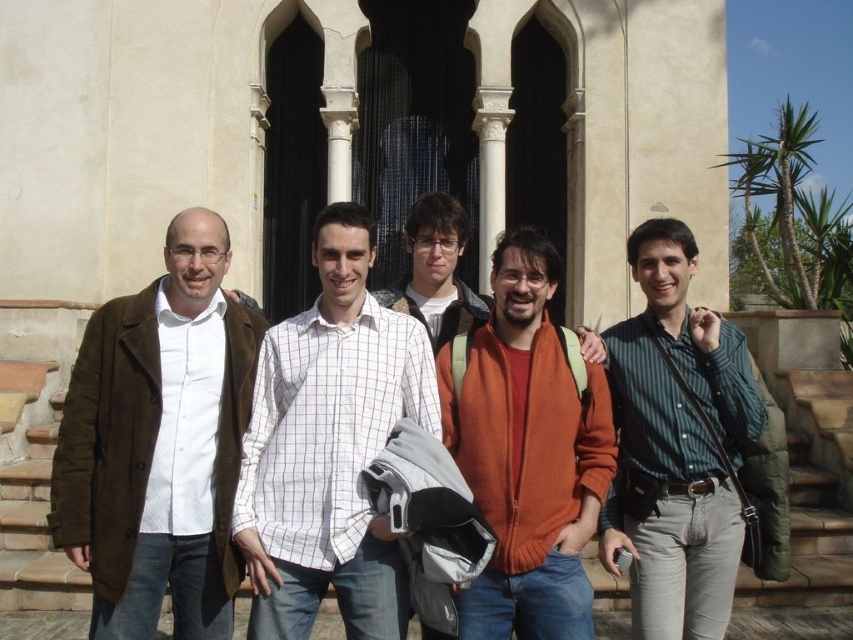
Consider the image. Who is positioned more to the right, brown suede coat at left or plaid shirt at center?

From the viewer's perspective, plaid shirt at center appears more on the right side.

Which is in front, point (196, 560) or point (427, 224)?

Point (196, 560) is in front.

What are the coordinates of `brown suede coat at left` in the screenshot? It's located at (160, 444).

Between point (190, 374) and point (581, 486), which one is positioned behind?

The point (190, 374) is more distant.

Does brown suede coat at left appear on the right side of orange fleece jacket at center?

Incorrect, brown suede coat at left is not on the right side of orange fleece jacket at center.

Which is in front, point (160, 570) or point (462, 614)?

Point (462, 614) is in front.

At what (x,y) coordinates should I click in order to perform the action: click on brown suede coat at left. Please return your answer as a coordinate pair (x, y). The height and width of the screenshot is (640, 853). Looking at the image, I should click on (160, 444).

Is point (489, 440) positioned before point (790, 600)?

Yes, point (489, 440) is closer to viewer.

Is point (575, 609) farther from camera compared to point (821, 544)?

No, it is in front of (821, 544).

This screenshot has height=640, width=853. What are the coordinates of `orange fleece jacket at center` in the screenshot? It's located at (527, 452).